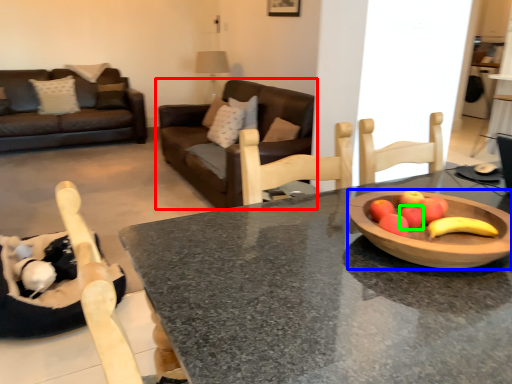
Question: Which object is the closest to the studio couch (highlighted by a red box)? Choose among these: bowl (highlighted by a blue box) or apple (highlighted by a green box).

Choices:
 (A) bowl
 (B) apple

Answer: (A)